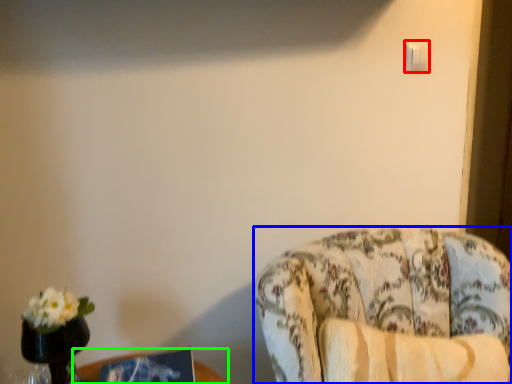
Question: Which object is the farthest from light switch (highlighted by a red box)? Choose among these: chair (highlighted by a blue box) or table (highlighted by a green box).

Choices:
 (A) chair
 (B) table

Answer: (B)